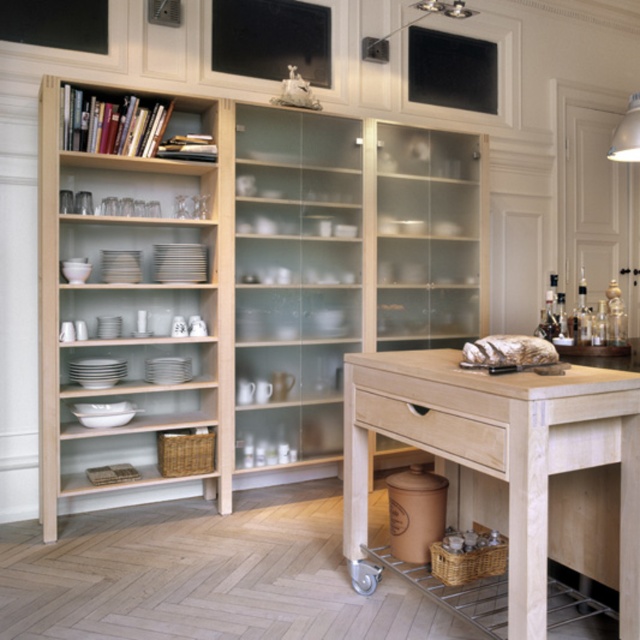
You are standing in the kitchen and want to place a new book on the natural wood bookshelf at upper left. Based on the coordinates provided, can you estimate its location relative to the center of the image?

The natural wood bookshelf at upper left is located at coordinates point (x=244, y=285), which places it slightly to the left and above the center of the image.

You are setting up a dining area and want to place a centerpiece on the light wood table at center. Where should you place it in relation to the light wood drawer at center?

The light wood table at center is below the light wood drawer at center, so you should place the centerpiece on the table directly under the drawer.

You are arranging a shelf in the kitchen and need to place both the natural wood bookshelf at upper left and the light wood bookshelf at left. Given their positions, which one is located higher?

The natural wood bookshelf at upper left is located higher than the light wood bookshelf at left because it is positioned above it.